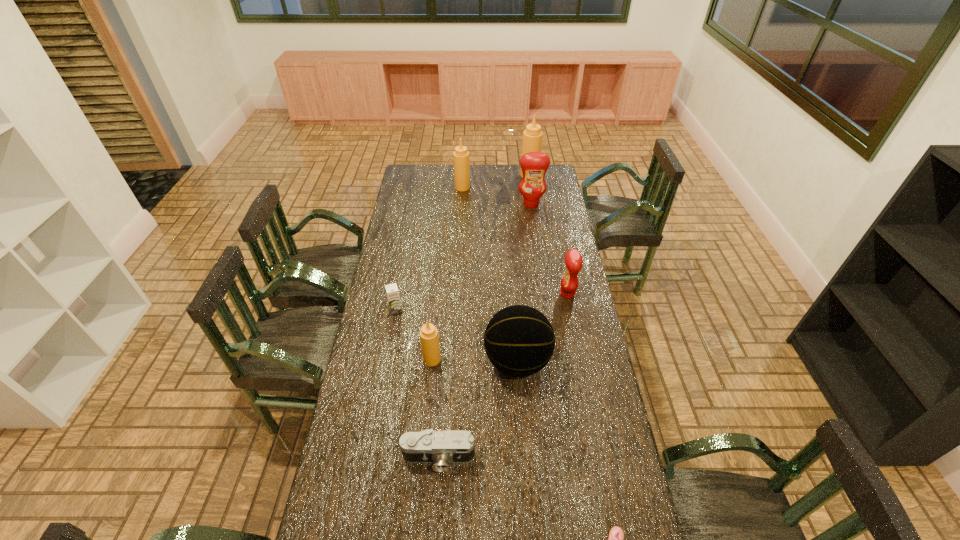
This screenshot has height=540, width=960. In order to click on the leftmost condiment in this screenshot , I will do `click(429, 338)`.

You are a GUI agent. You are given a task and a screenshot of the screen. Output one action in this format:
    pyautogui.click(x=<x>, y=<y>)
    Task: Click on the brown chocolate milk
    Image resolution: width=960 pixels, height=540 pixels.
    Given the screenshot: What is the action you would take?
    pos(392,291)

Where is `chocolate milk`? The height and width of the screenshot is (540, 960). chocolate milk is located at coordinates (392, 291).

Where is `camera`? This screenshot has height=540, width=960. camera is located at coordinates (441, 447).

The image size is (960, 540). I want to click on the second nearest object, so click(x=441, y=447).

Where is `free location located 0.110m on the left of the tallest condiment`? free location located 0.110m on the left of the tallest condiment is located at coordinates (502, 176).

I want to click on vacant region located 0.230m on the left of the second farthest tan condiment, so click(x=415, y=187).

Find the location of a particular element. This screenshot has height=540, width=960. vacant region located 0.080m on the label side of the seventh nearest object is located at coordinates (533, 218).

At what (x,y) coordinates should I click in order to perform the action: click on free space located 0.260m on the front of the basketball. Please return your answer as a coordinate pair (x, y). This screenshot has width=960, height=540. Looking at the image, I should click on (525, 463).

Identify the location of free space located on the label side of the smaller red condiment. This screenshot has width=960, height=540. (527, 294).